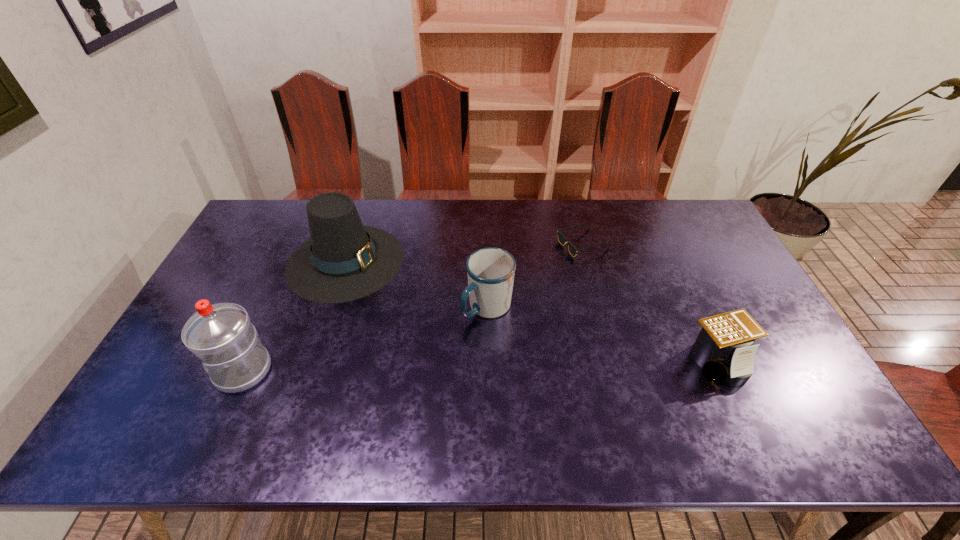
This screenshot has height=540, width=960. Find the location of `free space between the mug and the water bottle`. free space between the mug and the water bottle is located at coordinates (366, 339).

At what (x,y) coordinates should I click in order to perform the action: click on vacant space that is in between the shortest object and the second shortest object. Please return your answer as a coordinate pair (x, y). The image size is (960, 540). Looking at the image, I should click on (650, 303).

Select which object is the third closest to the water bottle. Please provide its 2D coordinates. Your answer should be formatted as a tuple, i.e. [(x, y)], where the tuple contains the x and y coordinates of a point satisfying the conditions above.

[(562, 239)]

Find the location of a particular element. object that is the closest to the water bottle is located at coordinates (343, 260).

At what (x,y) coordinates should I click in order to perform the action: click on blank space that satisfies the following two spatial constraints: 1. on the front side of the hat; 2. on the right side of the fourth tallest object. Please return your answer as a coordinate pair (x, y). Image resolution: width=960 pixels, height=540 pixels. Looking at the image, I should click on (312, 361).

Locate an element on the screen. The width and height of the screenshot is (960, 540). free space that satisfies the following two spatial constraints: 1. on the front side of the rightmost object; 2. on the right side of the hat is located at coordinates (312, 361).

The height and width of the screenshot is (540, 960). Find the location of `free space that satisfies the following two spatial constraints: 1. on the back side of the mug; 2. on the left side of the fourth object from left to right`. free space that satisfies the following two spatial constraints: 1. on the back side of the mug; 2. on the left side of the fourth object from left to right is located at coordinates (487, 244).